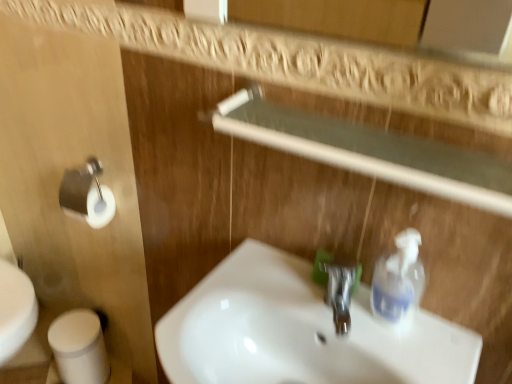
Question: Considering the relative sizes of clear plastic soap dispenser at right and polished chrome faucet at center in the image provided, is clear plastic soap dispenser at right shorter than polished chrome faucet at center?

Choices:
 (A) no
 (B) yes

Answer: (A)

Question: From the image's perspective, does clear plastic soap dispenser at right appear lower than polished chrome faucet at center?

Choices:
 (A) no
 (B) yes

Answer: (A)

Question: Is clear plastic soap dispenser at right oriented away from polished chrome faucet at center?

Choices:
 (A) no
 (B) yes

Answer: (A)

Question: Is clear plastic soap dispenser at right further to the viewer compared to polished chrome faucet at center?

Choices:
 (A) yes
 (B) no

Answer: (B)

Question: Could you tell me if clear plastic soap dispenser at right is facing polished chrome faucet at center?

Choices:
 (A) no
 (B) yes

Answer: (A)

Question: From a real-world perspective, relative to white matte toilet paper at lower left, is white glossy sink at center vertically above or below?

Choices:
 (A) below
 (B) above

Answer: (B)

Question: Looking at their shapes, would you say white glossy sink at center is wider or thinner than white matte toilet paper at lower left?

Choices:
 (A) thin
 (B) wide

Answer: (B)

Question: From the image's perspective, is white glossy sink at center located above or below white matte toilet paper at lower left?

Choices:
 (A) above
 (B) below

Answer: (A)

Question: Based on their positions, is white glossy sink at center located to the left or right of white matte toilet paper at lower left?

Choices:
 (A) right
 (B) left

Answer: (A)

Question: Would you say white matte toilet paper at lower left is inside or outside clear plastic soap dispenser at right?

Choices:
 (A) outside
 (B) inside

Answer: (A)

Question: From their relative heights in the image, would you say white matte toilet paper at lower left is taller or shorter than clear plastic soap dispenser at right?

Choices:
 (A) tall
 (B) short

Answer: (A)

Question: Based on their positions, is white matte toilet paper at lower left located to the left or right of clear plastic soap dispenser at right?

Choices:
 (A) right
 (B) left

Answer: (B)

Question: Looking at the image, does white matte toilet paper at lower left seem bigger or smaller compared to clear plastic soap dispenser at right?

Choices:
 (A) big
 (B) small

Answer: (A)

Question: Which is correct: transparent glass balustrade at upper center is inside white matte toilet paper at lower left, or outside of it?

Choices:
 (A) inside
 (B) outside

Answer: (B)

Question: From a real-world perspective, is transparent glass balustrade at upper center physically located above or below white matte toilet paper at lower left?

Choices:
 (A) above
 (B) below

Answer: (A)